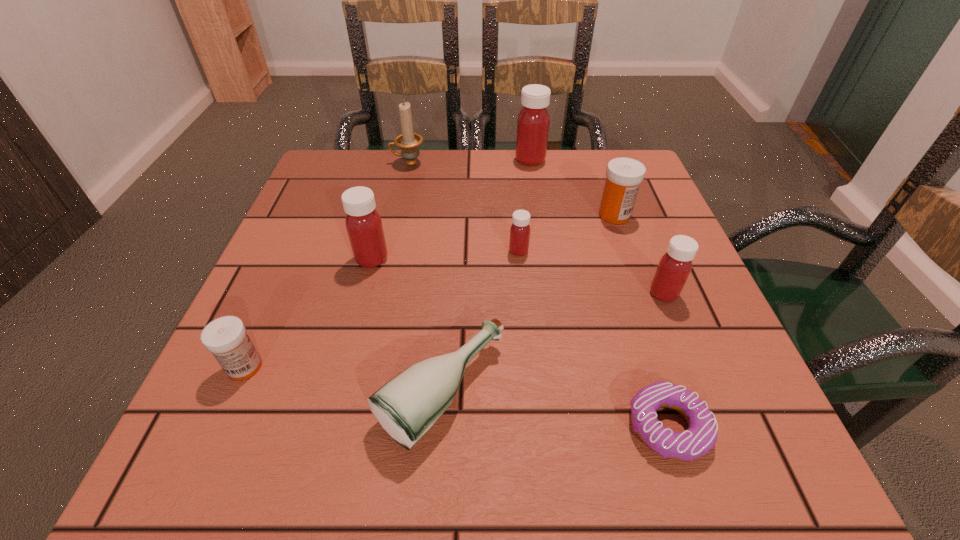
Identify the location of vacant space located on the back of the third farthest object. (591, 151).

Where is `vacant space located on the back of the fourth nearest object`? The width and height of the screenshot is (960, 540). vacant space located on the back of the fourth nearest object is located at coordinates (615, 173).

Identify the location of vacant position located 0.280m on the right of the smallest red medicine. (668, 251).

Find the location of `free space located on the right of the leftmost medicine`. free space located on the right of the leftmost medicine is located at coordinates (461, 367).

Identify the location of vacant region located on the right of the bottle. (754, 393).

The image size is (960, 540). I want to click on vacant space located on the left of the purple doughnut, so click(592, 426).

Where is `medicine located in the far edge section of the desktop`? medicine located in the far edge section of the desktop is located at coordinates (533, 122).

I want to click on candle_holder that is positioned at the far edge, so click(409, 142).

In order to click on bottle situated at the near edge in this screenshot , I will do `click(407, 406)`.

Locate an element on the screen. This screenshot has width=960, height=540. doughnut that is at the near edge is located at coordinates (701, 436).